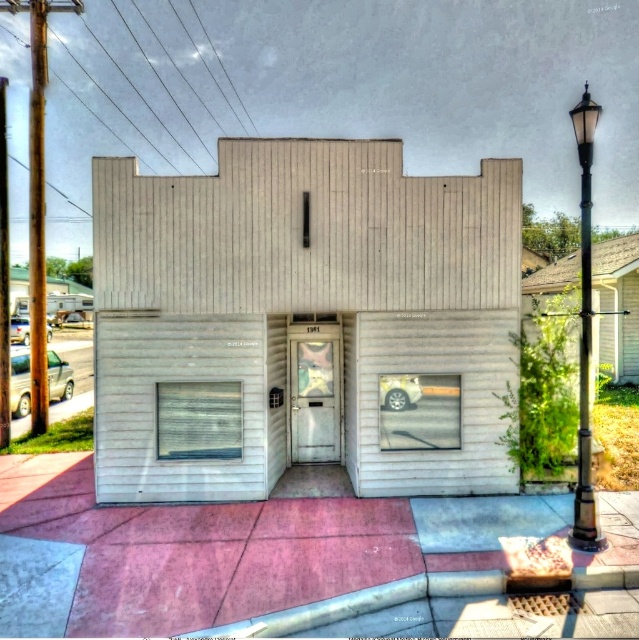
Who is more distant from viewer, [36,163] or [585,300]?

The point [36,163] is more distant.

Is point (31, 275) positioned after point (590, 131)?

Yes.

Find the location of a particular element. wooden utility pole at left is located at coordinates (36, 216).